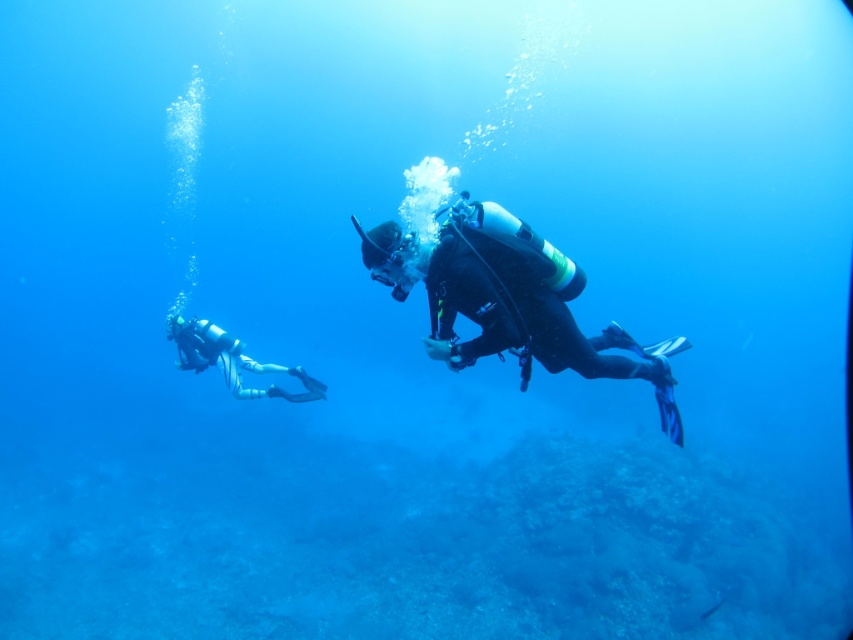
Which is below, black matte scuba diver at center or white matte scuba diver at lower left?

white matte scuba diver at lower left is below.

Between black matte scuba diver at center and white matte scuba diver at lower left, which one is positioned higher?

Positioned higher is black matte scuba diver at center.

The image size is (853, 640). Identify the location of black matte scuba diver at center. (502, 298).

You are a GUI agent. You are given a task and a screenshot of the screen. Output one action in this format:
    pyautogui.click(x=<x>, y=<y>)
    Task: Click on the black matte scuba diver at center
    The image size is (853, 640).
    Given the screenshot: What is the action you would take?
    pyautogui.click(x=502, y=298)